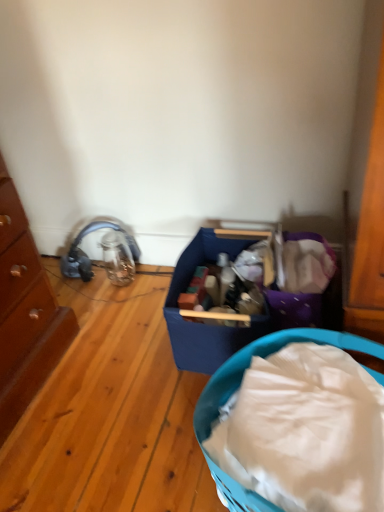
Question: Considering the positions of wooden chest of drawers at left and blue plastic basket at center in the image, is wooden chest of drawers at left bigger or smaller than blue plastic basket at center?

Choices:
 (A) small
 (B) big

Answer: (B)

Question: Relative to blue plastic basket at center, is wooden chest of drawers at left in front or behind?

Choices:
 (A) behind
 (B) front

Answer: (A)

Question: Is wooden chest of drawers at left wider or thinner than blue plastic basket at center?

Choices:
 (A) wide
 (B) thin

Answer: (B)

Question: Is blue plastic basket at center inside the boundaries of wooden chest of drawers at left, or outside?

Choices:
 (A) inside
 (B) outside

Answer: (B)

Question: Is blue plastic basket at center wider or thinner than wooden chest of drawers at left?

Choices:
 (A) thin
 (B) wide

Answer: (B)

Question: Is blue plastic basket at center taller or shorter than wooden chest of drawers at left?

Choices:
 (A) tall
 (B) short

Answer: (B)

Question: In terms of size, does blue plastic basket at center appear bigger or smaller than wooden chest of drawers at left?

Choices:
 (A) big
 (B) small

Answer: (B)